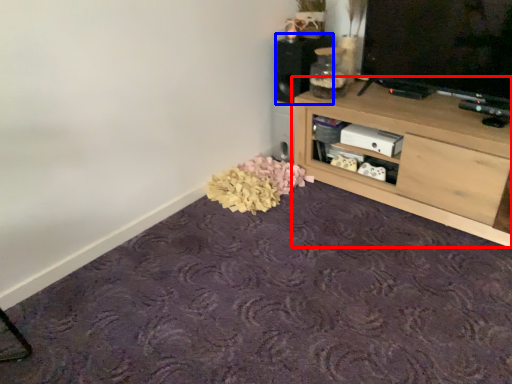
Question: Which object is closer to the camera taking this photo, shelf (highlighted by a red box) or speaker (highlighted by a blue box)?

Choices:
 (A) shelf
 (B) speaker

Answer: (A)